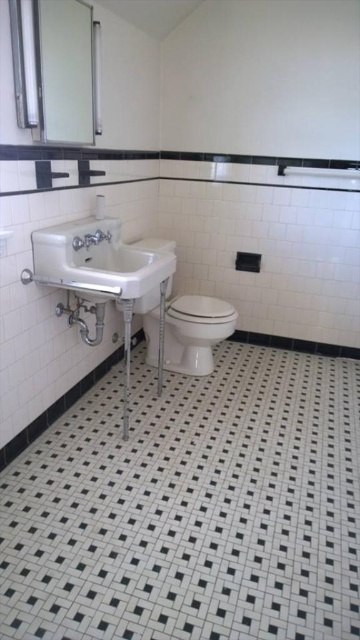
Question: Is white porcelain sink at left thinner than white glossy toilet bowl at center?

Choices:
 (A) no
 (B) yes

Answer: (A)

Question: Is white porcelain sink at left below white glossy mirror at upper left?

Choices:
 (A) yes
 (B) no

Answer: (A)

Question: Does black mosaic tile at center have a greater width compared to white glossy mirror at upper left?

Choices:
 (A) yes
 (B) no

Answer: (A)

Question: Which of the following is the closest to the observer?

Choices:
 (A) white porcelain sink at left
 (B) black mosaic tile at center
 (C) white glossy mirror at upper left

Answer: (B)

Question: Among these points, which one is farthest from the camera?

Choices:
 (A) (83, 269)
 (B) (74, 100)
 (C) (84, 440)
 (D) (108, 236)

Answer: (D)

Question: Which point is closer to the camera taking this photo?

Choices:
 (A) (189, 422)
 (B) (95, 240)

Answer: (B)